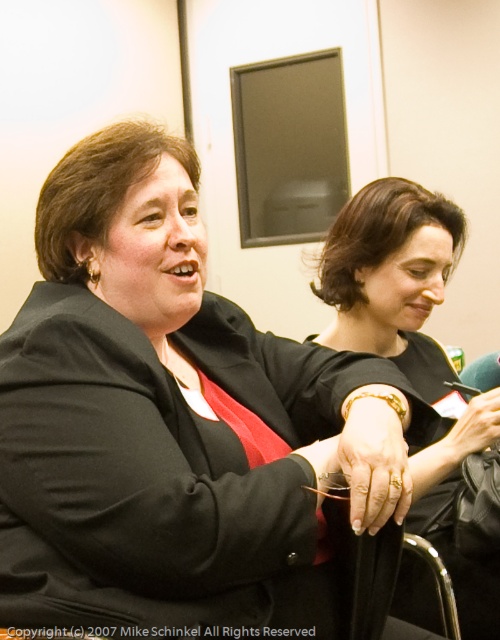
Consider the image. Who is taller, black matte dress at center or metallic silver chair at lower right?

Standing taller between the two is black matte dress at center.

Is black matte dress at center below metallic silver chair at lower right?

Actually, black matte dress at center is above metallic silver chair at lower right.

Measure the distance between black matte dress at center and camera.

black matte dress at center and camera are 1.29 meters apart from each other.

Find the location of a particular element. The width and height of the screenshot is (500, 640). black matte dress at center is located at coordinates (392, 276).